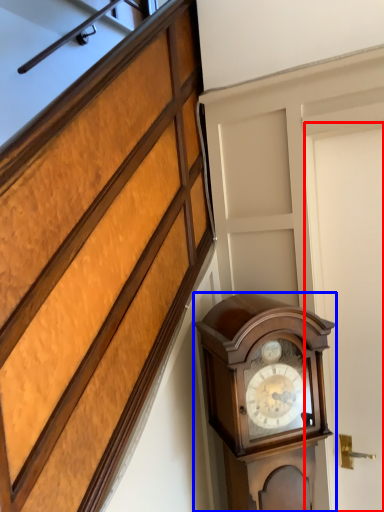
Question: Which object is further to the camera taking this photo, door (highlighted by a red box) or wall clock (highlighted by a blue box)?

Choices:
 (A) door
 (B) wall clock

Answer: (A)